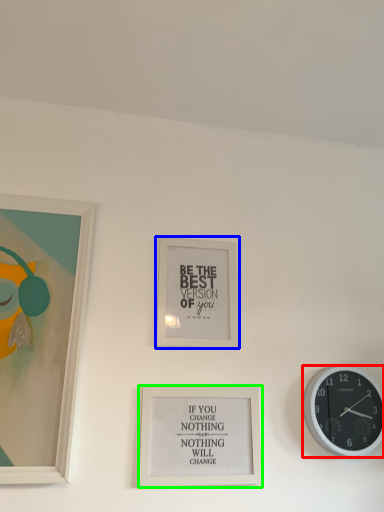
Question: Considering the real-world distances, which object is farthest from wall clock (highlighted by a red box)? picture frame (highlighted by a blue box) or picture frame (highlighted by a green box)?

Choices:
 (A) picture frame
 (B) picture frame

Answer: (A)